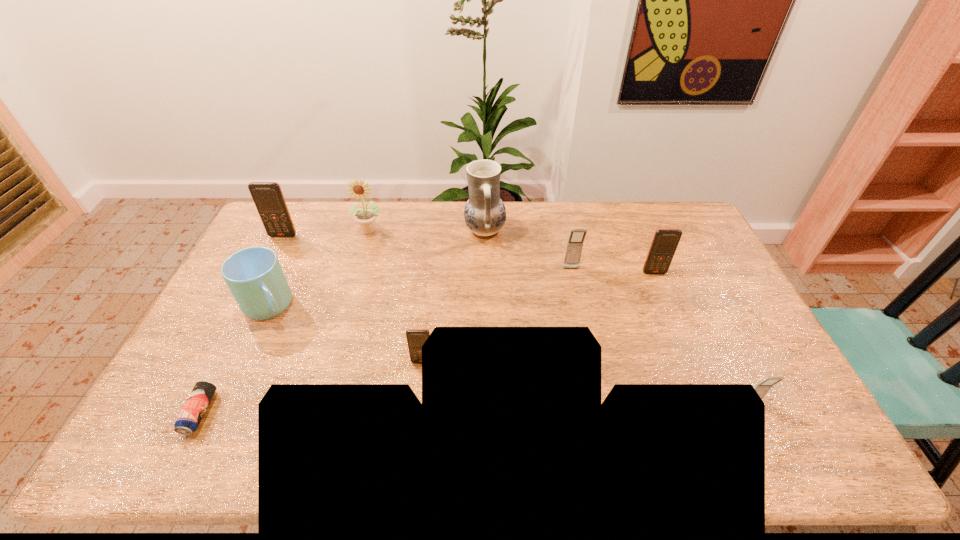
Image resolution: width=960 pixels, height=540 pixels. What are the coordinates of `blue pottery` in the screenshot? It's located at (484, 213).

The width and height of the screenshot is (960, 540). What are the coordinates of `pottery` in the screenshot? It's located at (484, 213).

The height and width of the screenshot is (540, 960). I want to click on sunflower, so point(366,218).

I want to click on the fourth object from left to right, so click(x=366, y=218).

This screenshot has width=960, height=540. In order to click on the leftmost cellular telephone in this screenshot , I will do `click(268, 197)`.

The width and height of the screenshot is (960, 540). What are the coordinates of `the tallest cellular telephone` in the screenshot? It's located at (268, 197).

At what (x,y) coordinates should I click in order to perform the action: click on the farther gray cellular telephone. Please return your answer as a coordinate pair (x, y). Image resolution: width=960 pixels, height=540 pixels. Looking at the image, I should click on (577, 236).

I want to click on the bigger gray cellular telephone, so click(577, 236).

The height and width of the screenshot is (540, 960). I want to click on the second farthest orange cellular telephone, so click(665, 241).

Find the location of `the second biggest orange cellular telephone`. the second biggest orange cellular telephone is located at coordinates (665, 241).